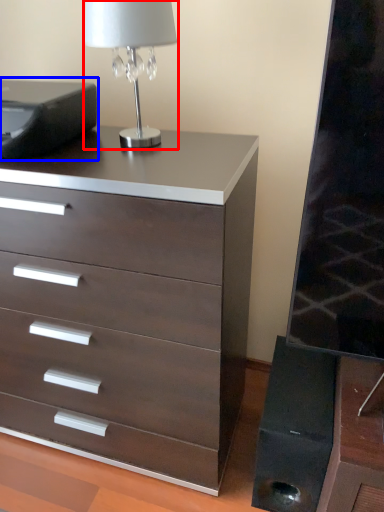
Question: Among these objects, which one is nearest to the camera, table lamp (highlighted by a red box) or printer (highlighted by a blue box)?

Choices:
 (A) table lamp
 (B) printer

Answer: (A)